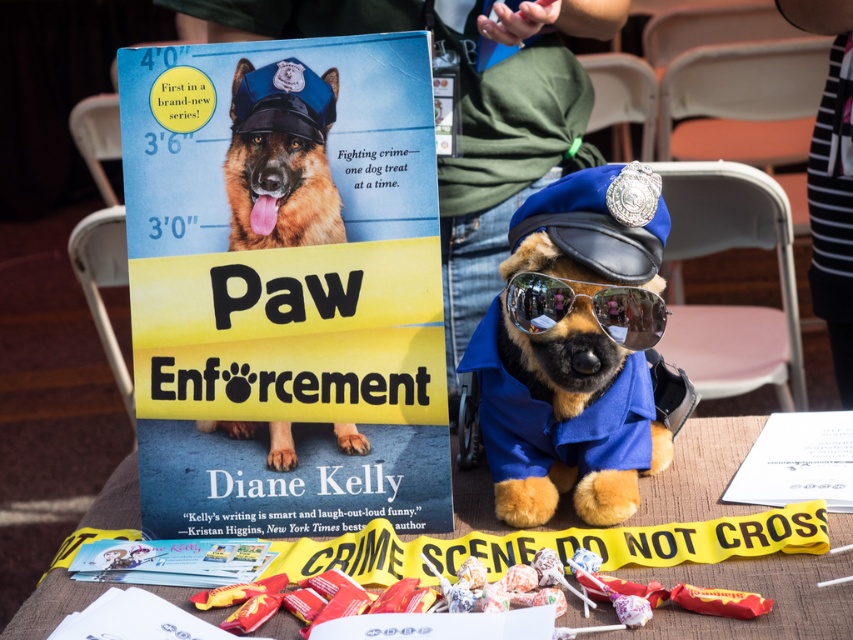
Which is below, wooden table at center or shiny brown fur at center?

wooden table at center

Between point (120, 474) and point (352, 440), which one is positioned in front?

Point (352, 440) is in front.

Is point (693, 452) more distant than point (242, 102)?

Yes, point (693, 452) is farther from viewer.

Find the location of a particular element. This screenshot has height=640, width=853. wooden table at center is located at coordinates (700, 470).

Who is lower down, shiny brown fur at center or matte plastic candy at lower center?

matte plastic candy at lower center is below.

Does shiny brown fur at center appear over matte plastic candy at lower center?

Correct, shiny brown fur at center is located above matte plastic candy at lower center.

Does point (265, 156) come farther from viewer compared to point (656, 596)?

Yes, it is.

What are the coordinates of `shiny brown fur at center` in the screenshot? It's located at (281, 157).

Does wooden table at center appear on the right side of reflective plastic goggles at center?

Correct, you'll find wooden table at center to the right of reflective plastic goggles at center.

Which is below, wooden table at center or reflective plastic goggles at center?

wooden table at center is lower down.

Does point (722, 634) come closer to viewer compared to point (556, 284)?

Yes, it is in front of point (556, 284).

The height and width of the screenshot is (640, 853). I want to click on wooden table at center, so click(700, 470).